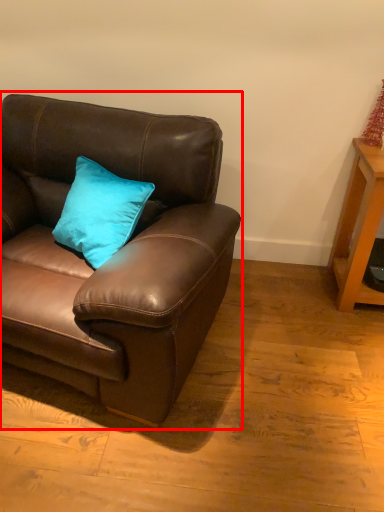
Question: Where is studio couch (annotated by the red box) located in relation to table in the image?

Choices:
 (A) right
 (B) left

Answer: (B)